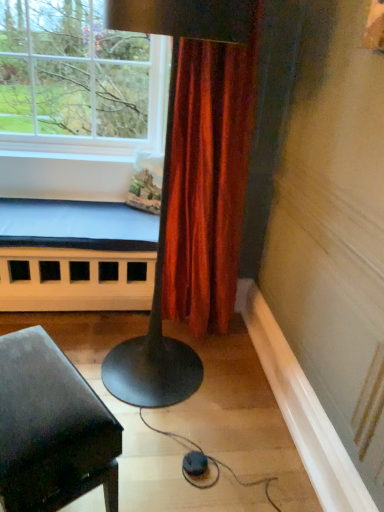
Question: In terms of width, does white painted wood bed frame at lower left look wider or thinner when compared to clear glass window at upper left?

Choices:
 (A) wide
 (B) thin

Answer: (B)

Question: Considering their positions, is white painted wood bed frame at lower left located in front of or behind clear glass window at upper left?

Choices:
 (A) front
 (B) behind

Answer: (B)

Question: Considering the real-world distances, which object is closest to the matte black piano at lower left?

Choices:
 (A) clear glass window at upper left
 (B) white painted wood bed frame at lower left

Answer: (B)

Question: Which is nearer to the matte black piano at lower left?

Choices:
 (A) clear glass window at upper left
 (B) white painted wood bed frame at lower left

Answer: (B)